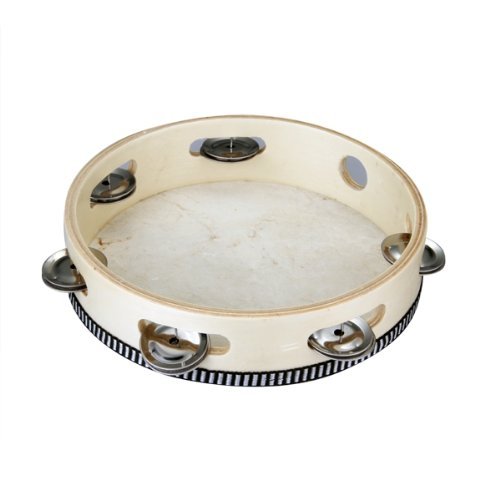
Locate an element on the screen. The image size is (500, 500). striped fabric is located at coordinates (309, 367).